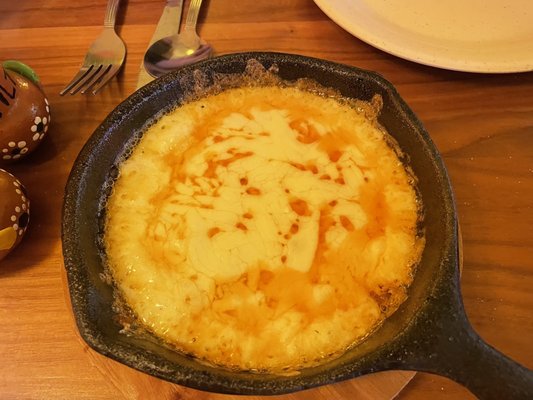
At what (x,y) coordinates should I click in order to perform the action: click on plates. Please return your answer as a coordinate pair (x, y). Image resolution: width=533 pixels, height=400 pixels. Looking at the image, I should click on pos(425,28), pos(364,383).